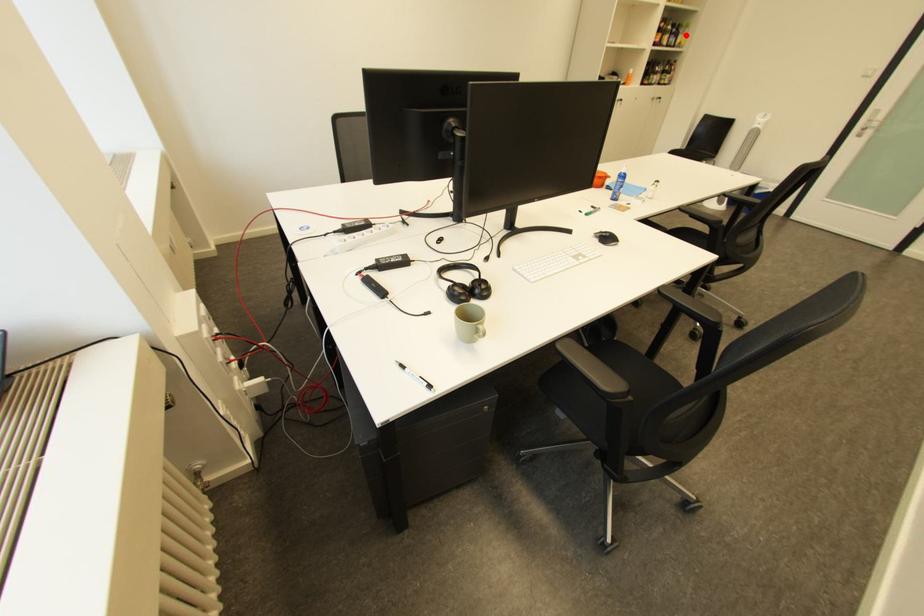
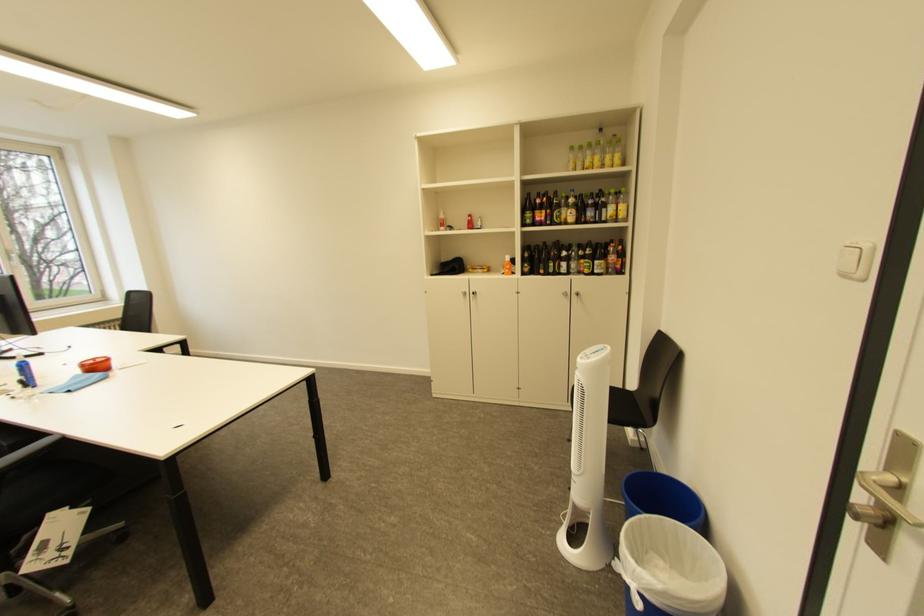
Question: I am providing you with two images of the same scene from different viewpoints. A red point is marked on the first image. Can you still see the location of the red point in image 2?

Choices:
 (A) Yes
 (B) No

Answer: (A)